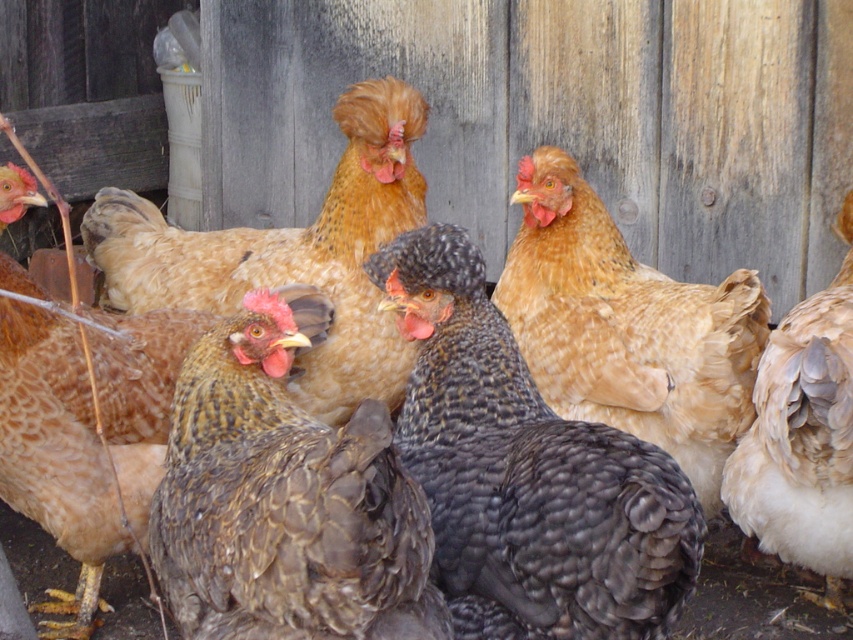
You are a farmer checking the chickens in the farmyard. You notice two chickens near the white plastic container on the left. Which chicken has a larger size between the brown speckled feathers at left and the light brown feathered chicken at right?

The brown speckled feathers at left is larger in size than the light brown feathered chicken at right according to the description.

You are a farmer checking on your chickens in the farmyard. You notice the brown speckled feathers at left and the light brown feathered chicken at right. Which chicken is positioned more to the left side of the image?

The brown speckled feathers at left is positioned more to the left side of the image than the light brown feathered chicken at right.

You are a farmer checking the chicken coop. You notice two chickens with golden brown feathers at center and brown speckled feathers at left. Which chicken is closer to you?

The golden brown feathers at center is closer to you because the brown speckled feathers at left is behind it.